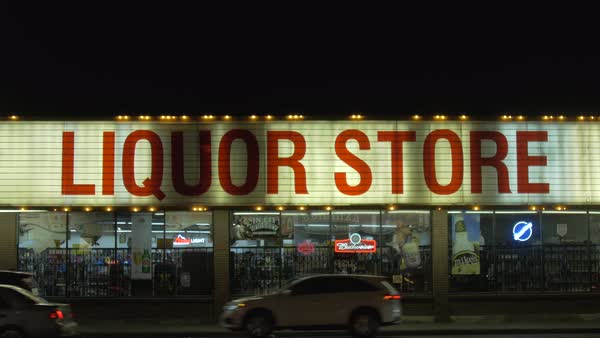
At what (x,y) coordinates should I click in order to perform the action: click on neon signs. Please return your answer as a coordinate pair (x, y). The height and width of the screenshot is (338, 600). Looking at the image, I should click on (360, 244), (525, 230), (183, 239), (197, 240).